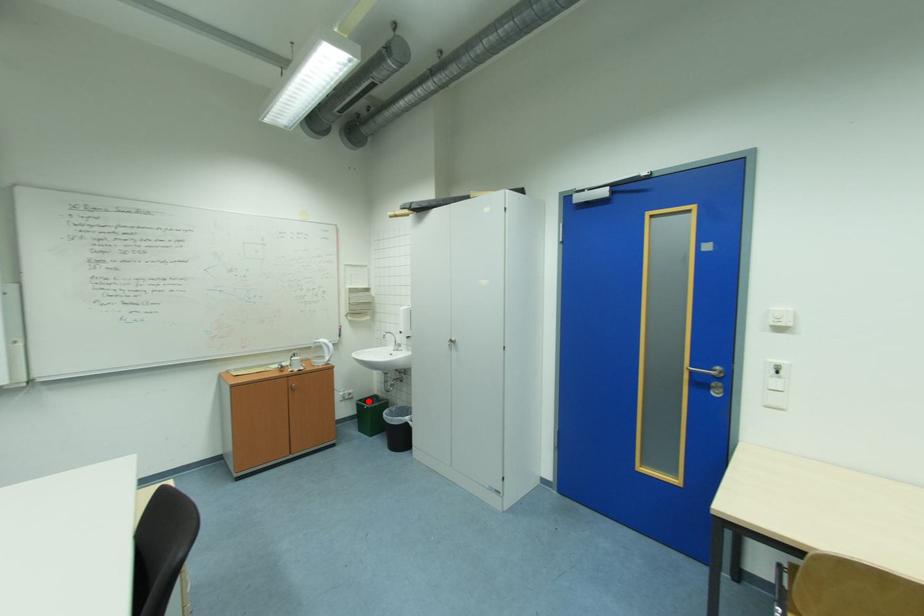
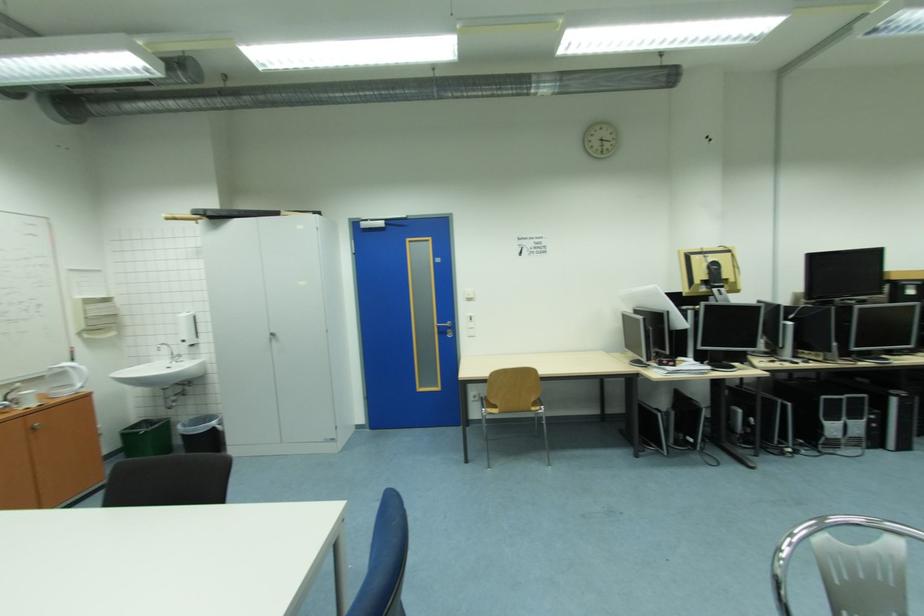
Locate, in the second image, the point that corresponds to the highlighted location in the first image.

(130, 431)